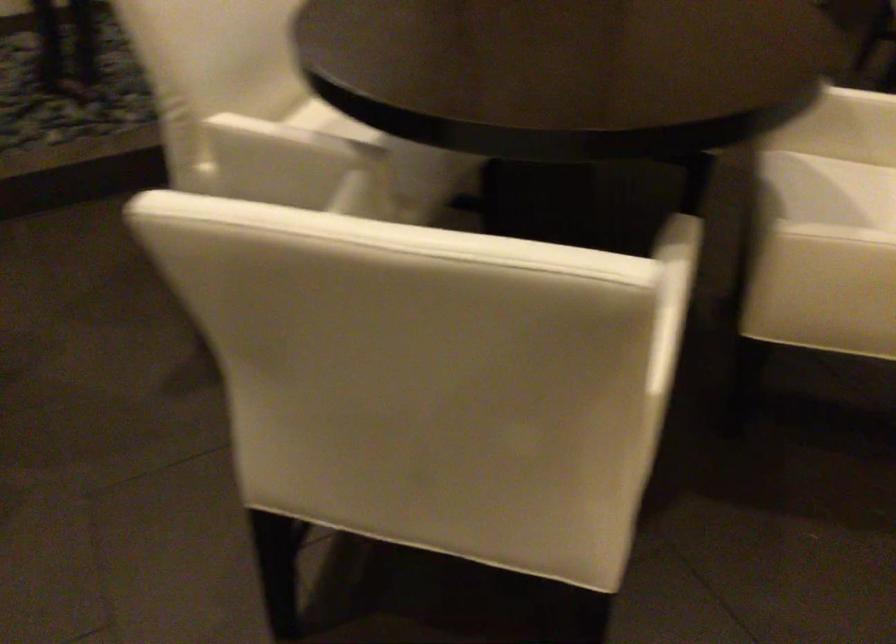
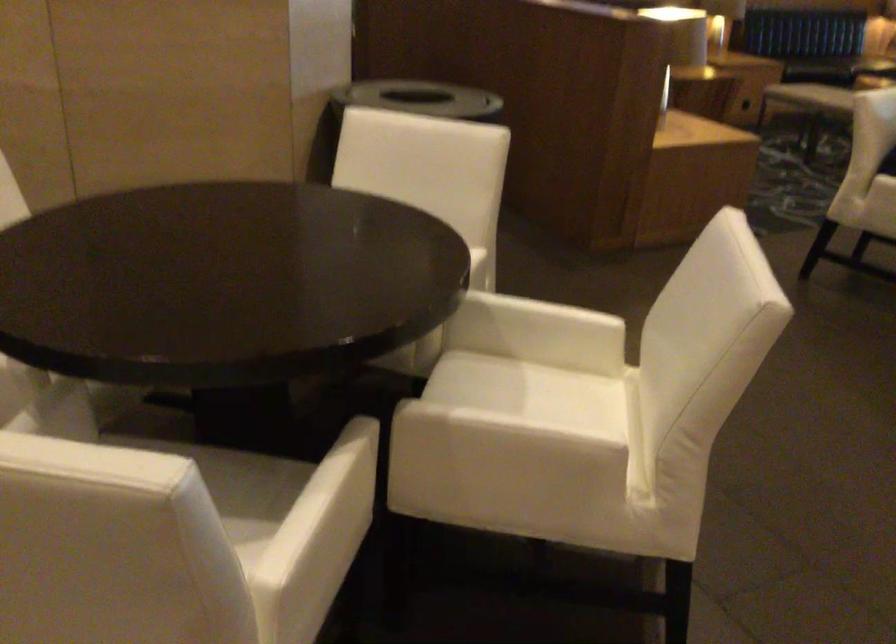
Question: Which direction would the cameraman need to move to produce the second image? Reply with the corresponding letter.

Choices:
 (A) Left
 (B) Right
 (C) Forward
 (D) Backward

Answer: (B)